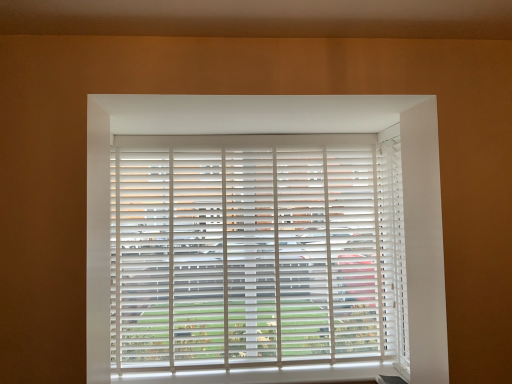
Question: Considering their positions, is white matte blinds at right located in front of or behind white matte blinds at center?

Choices:
 (A) front
 (B) behind

Answer: (A)

Question: In the image, is white matte blinds at right on the left side or the right side of white matte blinds at center?

Choices:
 (A) left
 (B) right

Answer: (B)

Question: From the image's perspective, is white matte blinds at right above or below white matte blinds at center?

Choices:
 (A) above
 (B) below

Answer: (A)

Question: In terms of height, does white matte blinds at center look taller or shorter compared to white matte blinds at right?

Choices:
 (A) tall
 (B) short

Answer: (B)

Question: In the image, is white matte blinds at center on the left side or the right side of white matte blinds at right?

Choices:
 (A) left
 (B) right

Answer: (A)

Question: Is white matte blinds at center inside the boundaries of white matte blinds at right, or outside?

Choices:
 (A) inside
 (B) outside

Answer: (B)

Question: From a real-world perspective, is white matte blinds at center physically located above or below white matte blinds at right?

Choices:
 (A) below
 (B) above

Answer: (B)